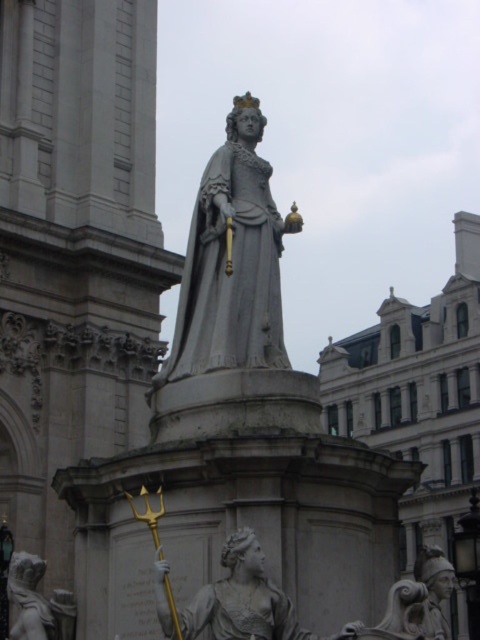
You are standing in front of the historical monument and want to take a photo of the matte gray statue at center. If your camera has a maximum focus range of 30 meters, will it be able to capture the statue clearly?

The matte gray statue at center is 29.88 meters away from camera, so yes, the camera can focus on it since the distance is within the 30 meters maximum range.

What is located at the coordinates point (231, 260) in the image?

The point (231, 260) indicates the gray stone statue at center.